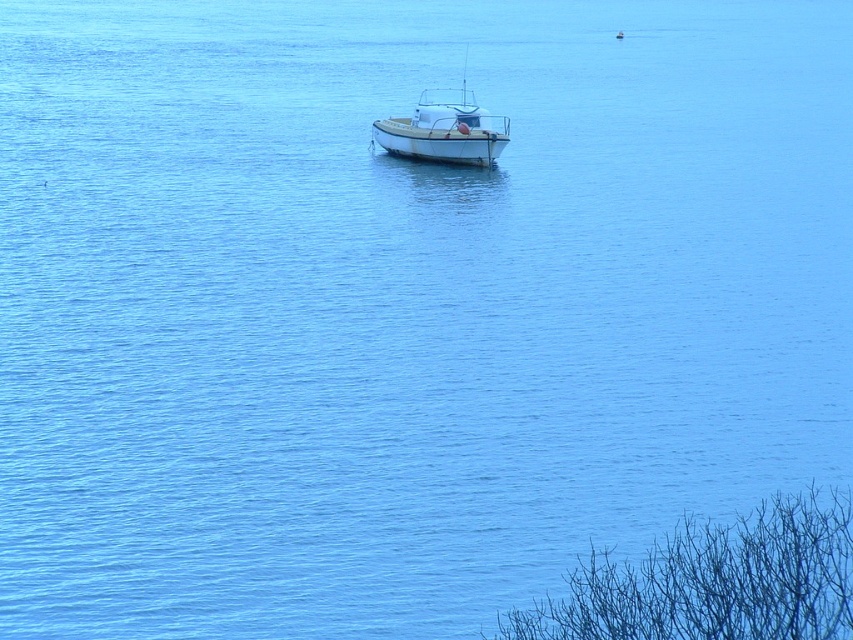
Question: Is bare branches at lower right in front of white matte boat at center?

Choices:
 (A) yes
 (B) no

Answer: (A)

Question: Which of the following is the closest to the observer?

Choices:
 (A) (479, 164)
 (B) (663, 582)

Answer: (B)

Question: Can you confirm if bare branches at lower right is wider than white matte boat at center?

Choices:
 (A) no
 (B) yes

Answer: (B)

Question: Can you confirm if bare branches at lower right is positioned above white matte boat at center?

Choices:
 (A) no
 (B) yes

Answer: (A)

Question: Which of the following is the closest to the observer?

Choices:
 (A) (817, 588)
 (B) (451, 108)

Answer: (A)

Question: Which point is farther to the camera?

Choices:
 (A) bare branches at lower right
 (B) white matte boat at center

Answer: (B)